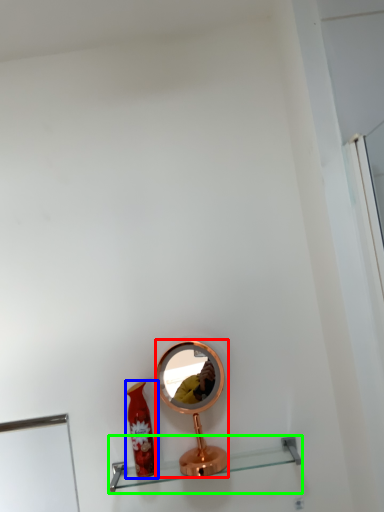
Question: Which object is positioned closest to mirror (highlighted by a red box)? Select from bottle (highlighted by a blue box) and shelf (highlighted by a green box).

Choices:
 (A) bottle
 (B) shelf

Answer: (A)